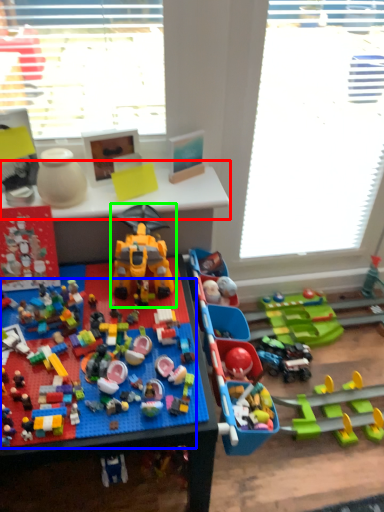
Question: Estimate the real-world distances between objects in this image. Which object is closer to table (highlighted by a red box), toy (highlighted by a blue box) or toy (highlighted by a green box)?

Choices:
 (A) toy
 (B) toy

Answer: (B)